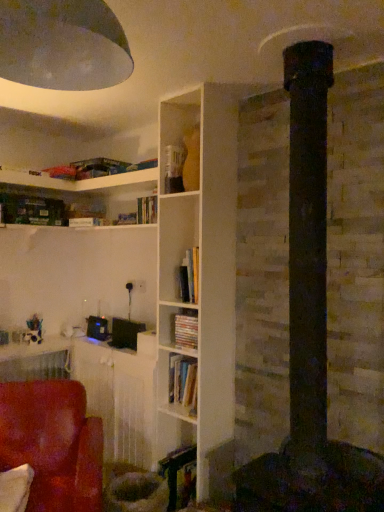
What do you see at coordinates (119, 397) in the screenshot? I see `wooden table at lower left` at bounding box center [119, 397].

You are a GUI agent. You are given a task and a screenshot of the screen. Output one action in this format:
    pyautogui.click(x=<x>, y=<y>)
    Task: Click on the metallic dome at upper left
    This screenshot has width=384, height=512.
    Given the screenshot: What is the action you would take?
    pyautogui.click(x=63, y=45)

Where is `suede-like red chair at lower left`? The image size is (384, 512). suede-like red chair at lower left is located at coordinates (53, 444).

From their relative heights in the image, would you say metallic dome at upper left is taller or shorter than suede-like red chair at lower left?

Clearly, metallic dome at upper left is shorter compared to suede-like red chair at lower left.

Is metallic dome at upper left far from suede-like red chair at lower left?

Indeed, metallic dome at upper left is not near suede-like red chair at lower left.

Is point (79, 39) more distant than point (68, 479)?

No, (79, 39) is in front of (68, 479).

Consider the image. Can we say metallic dome at upper left lies outside suede-like red chair at lower left?

Yes, metallic dome at upper left is not within suede-like red chair at lower left.

Considering the relative sizes of wooden table at lower left and suede-like red chair at lower left in the image provided, is wooden table at lower left wider than suede-like red chair at lower left?

Incorrect, the width of wooden table at lower left does not surpass that of suede-like red chair at lower left.

Considering the points (73, 345) and (3, 466), which point is in front, point (73, 345) or point (3, 466)?

The point (3, 466) is in front.

Are wooden table at lower left and suede-like red chair at lower left located far from each other?

No.

Considering the relative sizes of metallic dome at upper left and matte cardboard book at center in the image provided, is metallic dome at upper left smaller than matte cardboard book at center?

No.

From the image's perspective, which is below, metallic dome at upper left or matte cardboard book at center?

matte cardboard book at center.

How different are the orientations of metallic dome at upper left and matte cardboard book at center in degrees?

1.08 degrees separate the facing orientations of metallic dome at upper left and matte cardboard book at center.

Is the surface of metallic dome at upper left in direct contact with matte cardboard book at center?

No, metallic dome at upper left is not beside matte cardboard book at center.

How different are the orientations of suede-like red chair at lower left and metallic dome at upper left in degrees?

suede-like red chair at lower left and metallic dome at upper left are facing 53.8 degrees away from each other.

Is the position of suede-like red chair at lower left less distant than that of metallic dome at upper left?

No, suede-like red chair at lower left is further to the viewer.

Which object is thinner, suede-like red chair at lower left or metallic dome at upper left?

metallic dome at upper left.

From a real-world perspective, which object stands above the other?

metallic dome at upper left, from a real-world perspective.

Are suede-like red chair at lower left and wooden table at lower left far apart?

No, suede-like red chair at lower left is not far from wooden table at lower left.

Can you confirm if suede-like red chair at lower left is thinner than wooden table at lower left?

In fact, suede-like red chair at lower left might be wider than wooden table at lower left.

Can you confirm if suede-like red chair at lower left is shorter than wooden table at lower left?

Correct, suede-like red chair at lower left is not as tall as wooden table at lower left.

In order to click on table below the matte cardboard book at center (from the image's perspective) in this screenshot , I will do `click(119, 397)`.

From the picture: Is wooden table at lower left to the left or to the right of matte cardboard book at center in the image?

From the image, it's evident that wooden table at lower left is to the left of matte cardboard book at center.

From the picture: Choose the correct answer: Is wooden table at lower left inside matte cardboard book at center or outside it?

wooden table at lower left is not enclosed by matte cardboard book at center.

Find the location of a particular element. The height and width of the screenshot is (512, 384). lamp in front of the wooden table at lower left is located at coordinates (63, 45).

Is metallic dome at upper left positioned beyond the bounds of wooden table at lower left?

Absolutely, metallic dome at upper left is external to wooden table at lower left.

Is metallic dome at upper left bigger or smaller than wooden table at lower left?

Considering their sizes, metallic dome at upper left takes up less space than wooden table at lower left.

From a real-world perspective, which is physically above, metallic dome at upper left or wooden table at lower left?

metallic dome at upper left is physically above.

Identify the location of lamp in front of the suede-like red chair at lower left. (63, 45).

The width and height of the screenshot is (384, 512). I want to click on table behind the suede-like red chair at lower left, so click(x=119, y=397).

Based on their spatial positions, is wooden table at lower left or metallic dome at upper left further from matte cardboard book at center?

Based on the image, metallic dome at upper left appears to be further to matte cardboard book at center.

When comparing their distances from suede-like red chair at lower left, does wooden table at lower left or metallic dome at upper left seem further?

Among the two, metallic dome at upper left is located further to suede-like red chair at lower left.

Based on their spatial positions, is suede-like red chair at lower left or matte cardboard book at center closer to metallic dome at upper left?

matte cardboard book at center is closer to metallic dome at upper left.

Based on their spatial positions, is matte cardboard book at center or metallic dome at upper left closer to suede-like red chair at lower left?

matte cardboard book at center.

Looking at the image, which one is located closer to matte cardboard book at center, suede-like red chair at lower left or wooden table at lower left?

The object closer to matte cardboard book at center is wooden table at lower left.

In the scene shown: Considering their positions, is matte cardboard book at center positioned closer to wooden table at lower left than suede-like red chair at lower left?

Based on the image, suede-like red chair at lower left appears to be nearer to wooden table at lower left.

Looking at the image, which one is located further to wooden table at lower left, suede-like red chair at lower left or matte cardboard book at center?

The object further to wooden table at lower left is matte cardboard book at center.

Consider the image. When comparing their distances from wooden table at lower left, does suede-like red chair at lower left or metallic dome at upper left seem further?

Among the two, metallic dome at upper left is located further to wooden table at lower left.

Locate an element on the screen. This screenshot has height=512, width=384. book between metallic dome at upper left and wooden table at lower left in the front-back direction is located at coordinates (186, 328).

This screenshot has height=512, width=384. Find the location of `book between metallic dome at upper left and suede-like red chair at lower left vertically`. book between metallic dome at upper left and suede-like red chair at lower left vertically is located at coordinates (186, 328).

This screenshot has width=384, height=512. I want to click on book positioned between suede-like red chair at lower left and wooden table at lower left from near to far, so click(x=186, y=328).

The width and height of the screenshot is (384, 512). In order to click on table that lies between metallic dome at upper left and suede-like red chair at lower left from top to bottom in this screenshot , I will do `click(119, 397)`.